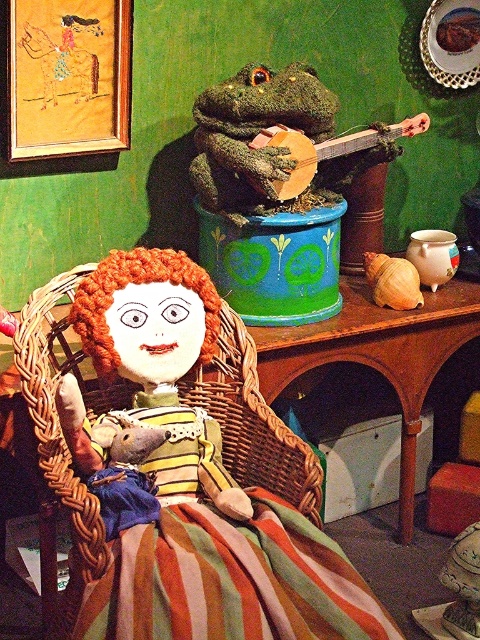
Question: Based on their relative distances, which object is nearer to the wooden table at center?

Choices:
 (A) striped fabric at lower center
 (B) gold fabric picture frame at upper left
 (C) green fuzzy frog at upper center

Answer: (C)

Question: Does striped fabric at lower center come behind gold fabric picture frame at upper left?

Choices:
 (A) yes
 (B) no

Answer: (B)

Question: Can you confirm if gold fabric picture frame at upper left is bigger than wooden banjo at upper center?

Choices:
 (A) yes
 (B) no

Answer: (B)

Question: Which object is closer to the camera taking this photo?

Choices:
 (A) striped fabric at lower center
 (B) gold fabric picture frame at upper left
 (C) woven wicker basket at center
 (D) green fuzzy frog at upper center

Answer: (A)

Question: Which of the following is the closest to the observer?

Choices:
 (A) gold fabric picture frame at upper left
 (B) green fuzzy frog at upper center
 (C) woven wicker basket at center

Answer: (C)

Question: Is striped fabric at lower center smaller than wooden banjo at upper center?

Choices:
 (A) no
 (B) yes

Answer: (B)